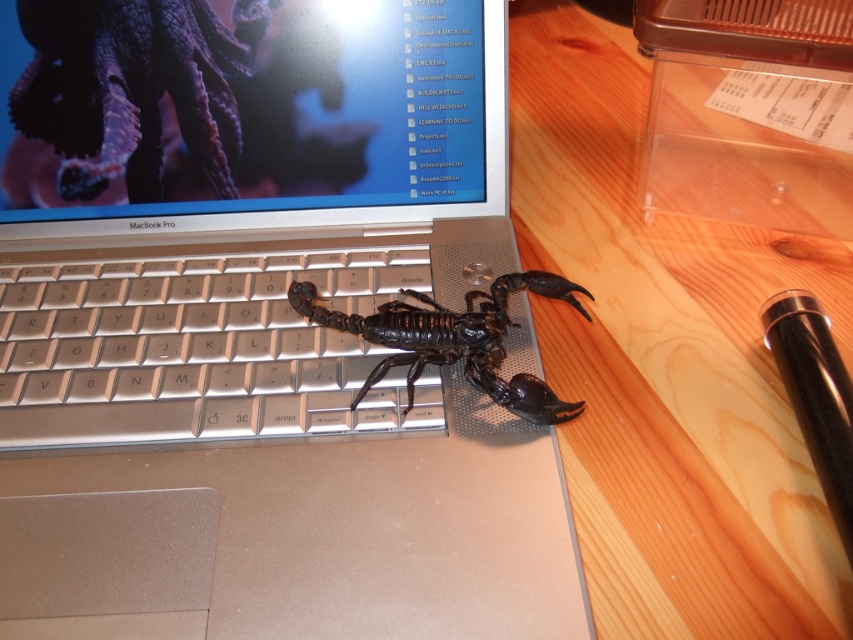
Question: Can you confirm if satin silver laptop at center is smaller than black metallic pen at right?

Choices:
 (A) no
 (B) yes

Answer: (A)

Question: Can you confirm if satin silver laptop at center is positioned above black metallic pen at right?

Choices:
 (A) no
 (B) yes

Answer: (B)

Question: Is the position of glossy plastic screen at upper center less distant than that of black glossy scorpion at center?

Choices:
 (A) yes
 (B) no

Answer: (B)

Question: Which object is the farthest from the silver metallic keyboard at center?

Choices:
 (A) black metallic pen at right
 (B) satin silver laptop at center
 (C) black glossy scorpion at center

Answer: (A)

Question: Which object is closer to the camera taking this photo?

Choices:
 (A) black metallic pen at right
 (B) satin silver laptop at center
 (C) silver metallic keyboard at center
 (D) purple matte octopus at upper left

Answer: (B)

Question: Among these points, which one is nearest to the camera?

Choices:
 (A) (802, 330)
 (B) (373, 397)
 (C) (167, 1)
 (D) (287, 4)

Answer: (B)